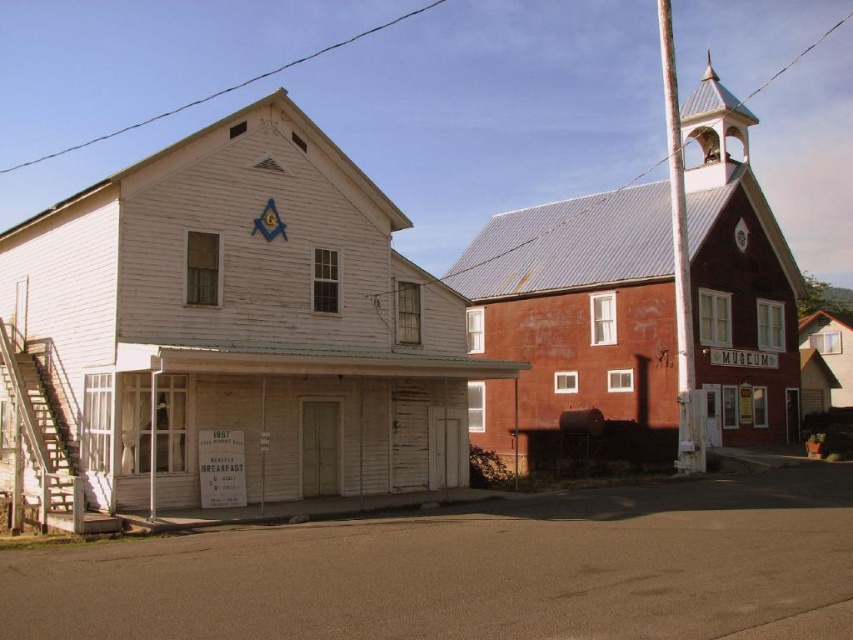
Question: Among these points, which one is farthest from the camera?

Choices:
 (A) (566, 324)
 (B) (10, 317)

Answer: (A)

Question: Does white wooden chapel at left have a lesser width compared to rustic wood chapel at right?

Choices:
 (A) no
 (B) yes

Answer: (B)

Question: Does white wooden chapel at left appear over rustic wood chapel at right?

Choices:
 (A) yes
 (B) no

Answer: (B)

Question: Is white wooden chapel at left positioned behind rustic wood chapel at right?

Choices:
 (A) yes
 (B) no

Answer: (B)

Question: Which point appears closest to the camera in this image?

Choices:
 (A) (753, 424)
 (B) (175, 436)

Answer: (B)